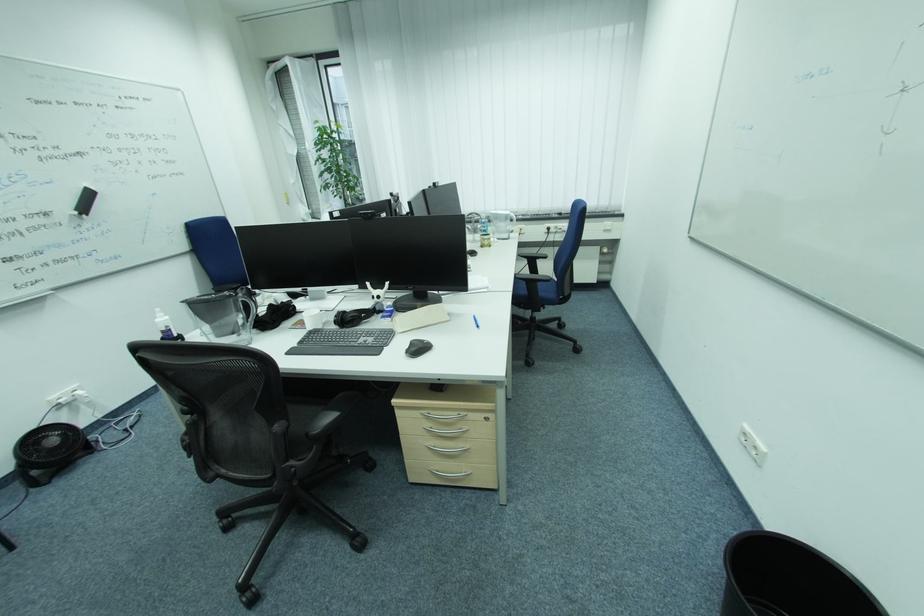
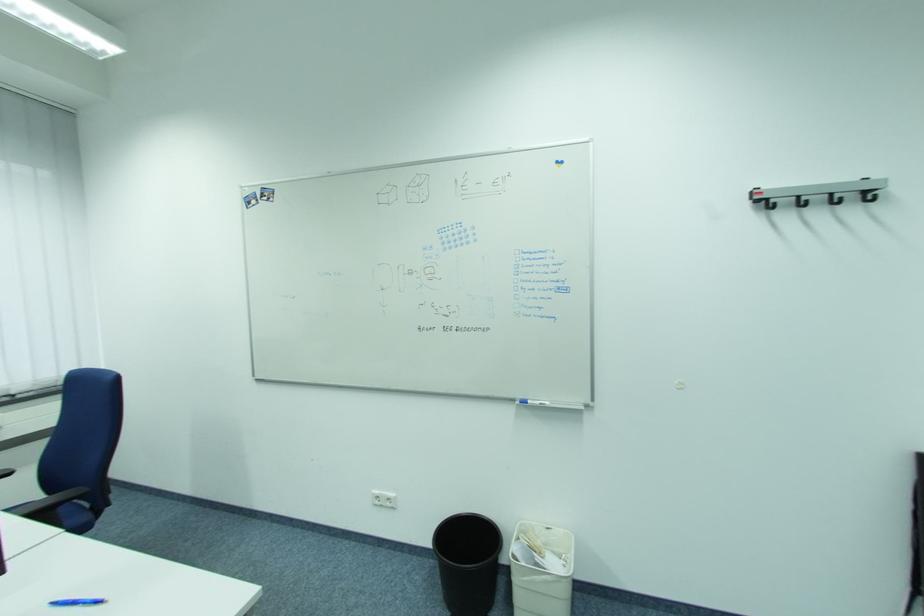
Question: Based on the continuous images, in which direction is the camera rotating? Reply with the corresponding letter.

Choices:
 (A) Left
 (B) Right
 (C) Up
 (D) Down

Answer: (B)